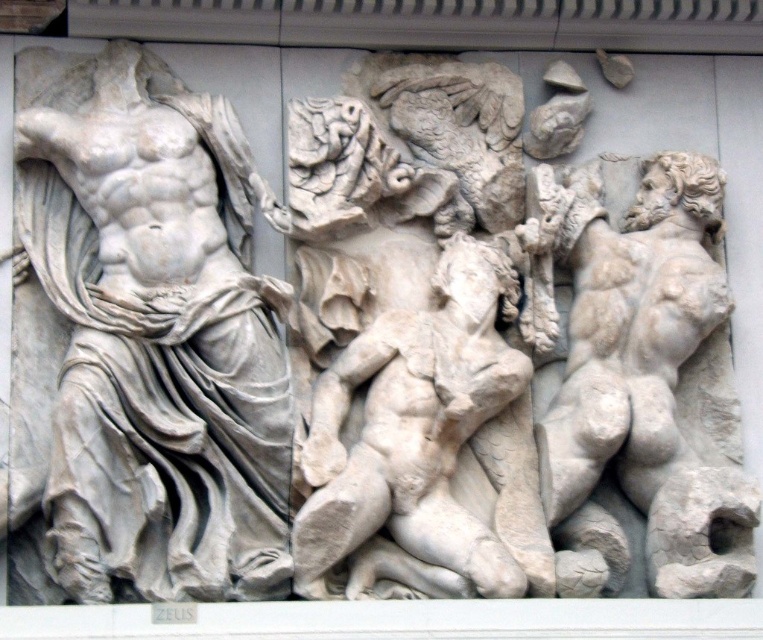
Does white marble muscular figure at right lie behind white marble nude figure at center?

Yes, it is behind white marble nude figure at center.

Does white marble muscular figure at right have a lesser height compared to white marble nude figure at center?

Incorrect, white marble muscular figure at right's height does not fall short of white marble nude figure at center's.

This screenshot has width=763, height=640. What do you see at coordinates (649, 378) in the screenshot?
I see `white marble muscular figure at right` at bounding box center [649, 378].

At what (x,y) coordinates should I click in order to perform the action: click on white marble muscular figure at right. Please return your answer as a coordinate pair (x, y). The image size is (763, 640). Looking at the image, I should click on (649, 378).

Does white marble torso at left have a lesser height compared to white marble nude figure at center?

No, white marble torso at left is not shorter than white marble nude figure at center.

Between white marble torso at left and white marble nude figure at center, which one has more height?

Standing taller between the two is white marble torso at left.

This screenshot has width=763, height=640. I want to click on white marble torso at left, so click(x=155, y=337).

Is point (63, 244) positioned before point (670, 540)?

No, (63, 244) is behind (670, 540).

Does point (66, 120) lie in front of point (549, 456)?

No, (66, 120) is further to viewer.

Where is `white marble torso at left`? white marble torso at left is located at coordinates (155, 337).